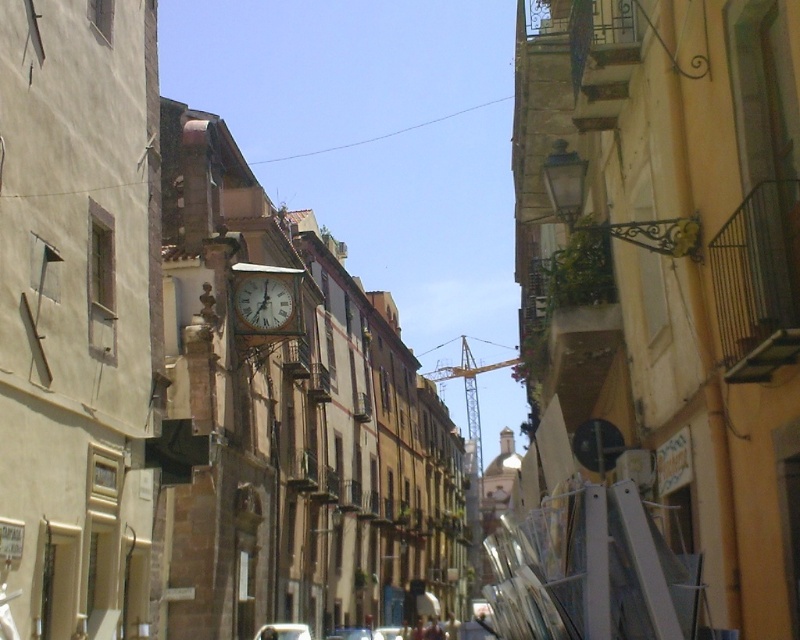
Question: Can you confirm if wooden clock at center is smaller than metallic silver car at center?

Choices:
 (A) no
 (B) yes

Answer: (B)

Question: Can you confirm if metallic silver car at lower center is positioned above white matte car at center?

Choices:
 (A) yes
 (B) no

Answer: (A)

Question: Among these objects, which one is nearest to the camera?

Choices:
 (A) white matte car at center
 (B) metallic silver car at lower center

Answer: (B)

Question: Is white matte car at center thinner than metallic silver car at center?

Choices:
 (A) yes
 (B) no

Answer: (B)

Question: Estimate the real-world distances between objects in this image. Which object is farther from the metallic silver car at lower center?

Choices:
 (A) metallic silver car at center
 (B) white matte car at center

Answer: (A)

Question: Which point is farther from the camera taking this photo?

Choices:
 (A) (332, 636)
 (B) (264, 632)

Answer: (A)